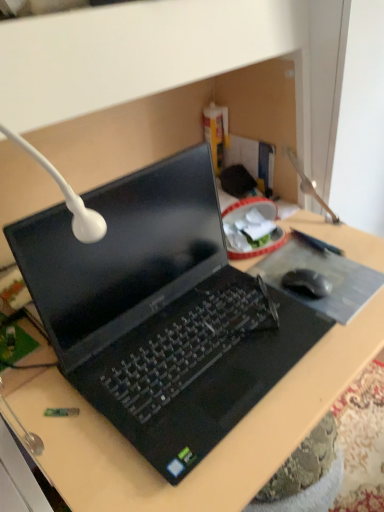
At what (x,y) coordinates should I click in order to perform the action: click on vacant area that lies to the right of black rubber mouse at right. Please return your answer as a coordinate pair (x, y). Looking at the image, I should click on (349, 283).